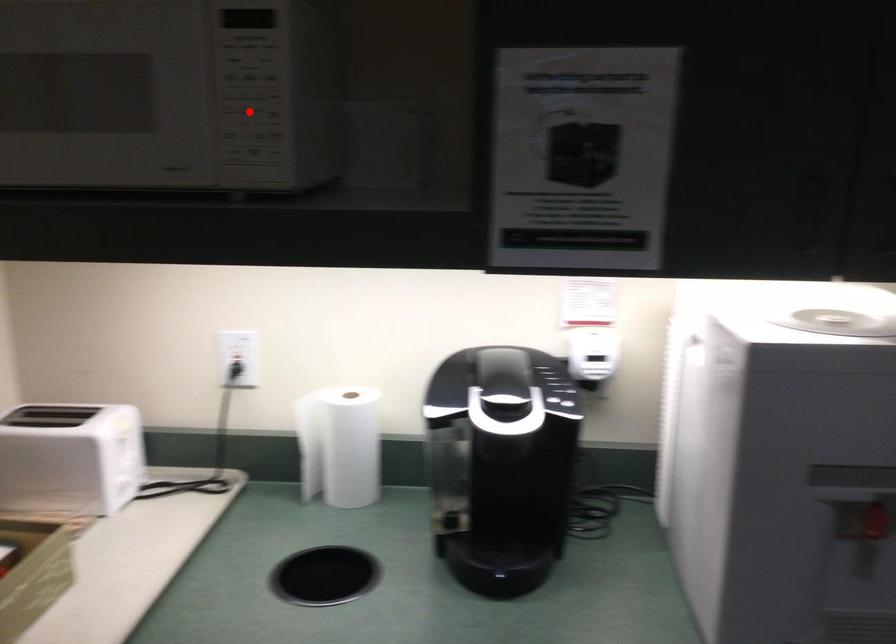
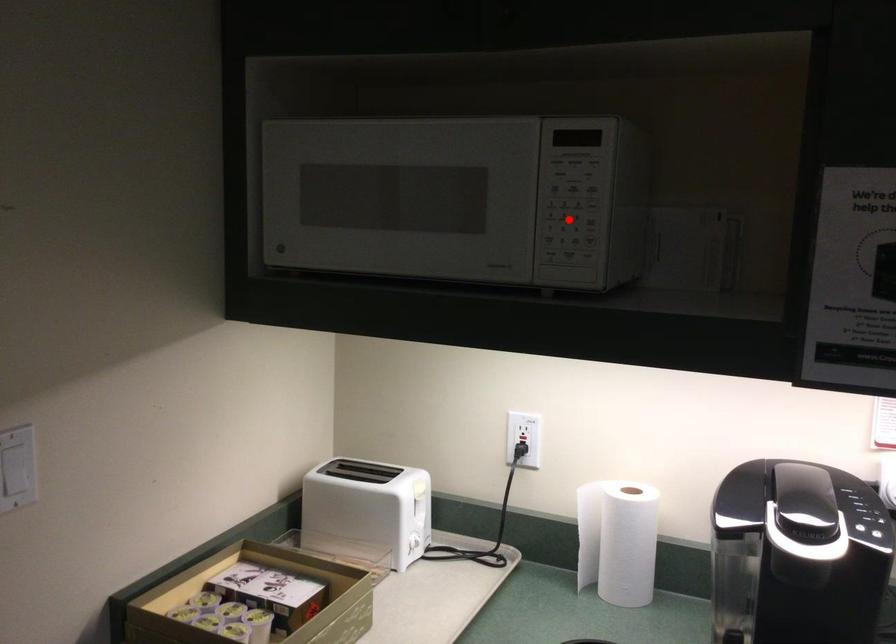
I am providing you with two images of the same scene from different viewpoints. A red point is marked on the first image and another point is marked on the second image. Is the marked point in image1 the same physical position as the marked point in image2?

Yes